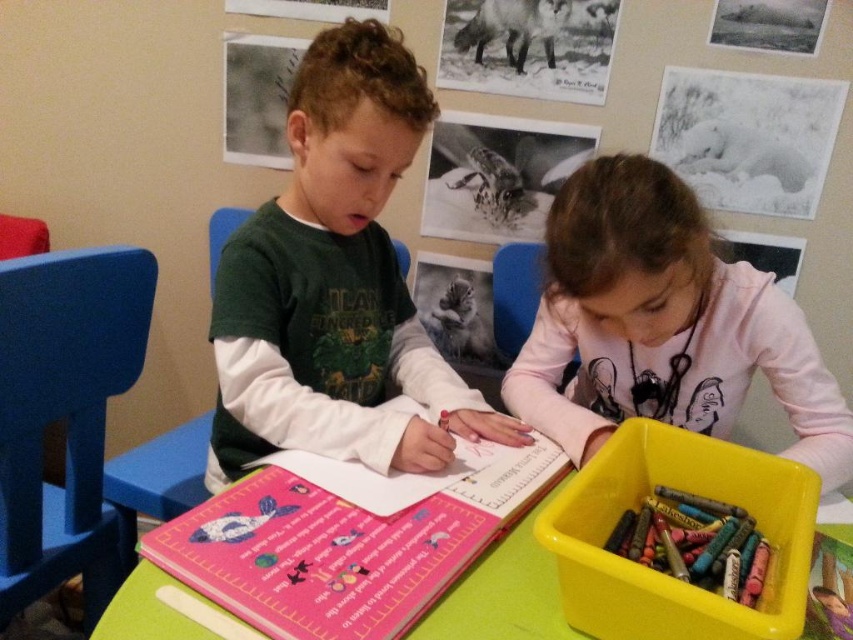
Does point (740, 336) lie in front of point (749, 532)?

That is False.

Is pink cotton shirt at center shorter than matte plastic crayons at lower right?

No.

You are a GUI agent. You are given a task and a screenshot of the screen. Output one action in this format:
    pyautogui.click(x=<x>, y=<y>)
    Task: Click on the pink cotton shirt at center
    
    Given the screenshot: What is the action you would take?
    pyautogui.click(x=663, y=324)

Is point (563, 241) closer to viewer compared to point (187, 536)?

No.

Does pink cotton shirt at center appear over pink matte book at center?

Yes, pink cotton shirt at center is above pink matte book at center.

The width and height of the screenshot is (853, 640). I want to click on pink cotton shirt at center, so click(663, 324).

You are a GUI agent. You are given a task and a screenshot of the screen. Output one action in this format:
    pyautogui.click(x=<x>, y=<y>)
    Task: Click on the pink cotton shirt at center
    This screenshot has width=853, height=640.
    Given the screenshot: What is the action you would take?
    pyautogui.click(x=663, y=324)

Is green matte shirt at center to the left of pink matte book at center from the viewer's perspective?

Yes, green matte shirt at center is to the left of pink matte book at center.

Is green matte shirt at center to the right of pink matte book at center from the viewer's perspective?

Incorrect, green matte shirt at center is not on the right side of pink matte book at center.

Between point (274, 380) and point (222, 502), which one is positioned behind?

The point (274, 380) is behind.

Locate an element on the screen. The height and width of the screenshot is (640, 853). green matte shirt at center is located at coordinates (335, 284).